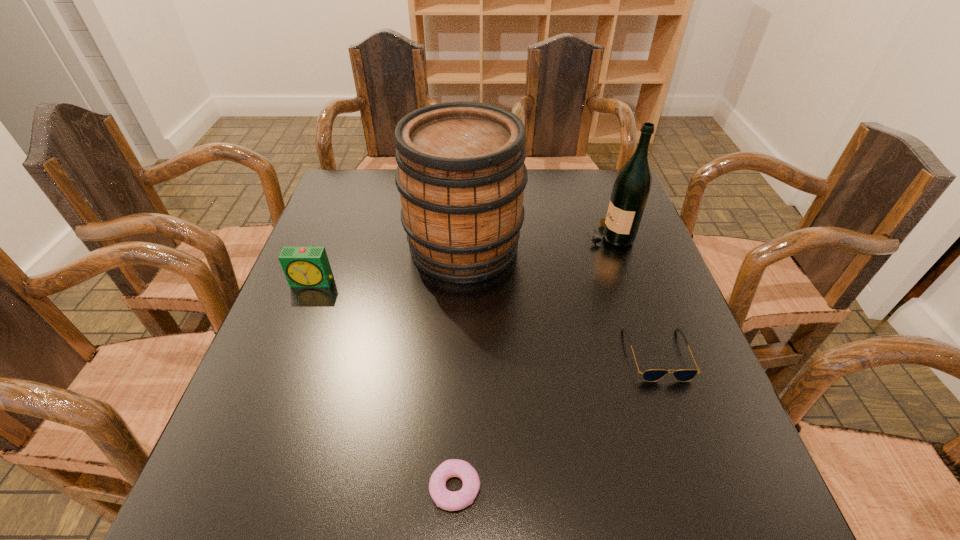
I want to click on cider, so click(x=461, y=175).

The image size is (960, 540). In order to click on wine bottle in this screenshot , I will do `click(631, 189)`.

Locate an element on the screen. This screenshot has width=960, height=540. the third shortest object is located at coordinates (304, 267).

You are a GUI agent. You are given a task and a screenshot of the screen. Output one action in this format:
    pyautogui.click(x=<x>, y=<y>)
    Task: Click on the leftmost object
    
    Given the screenshot: What is the action you would take?
    pyautogui.click(x=304, y=267)

Identify the location of the second shortest object. The image size is (960, 540). (652, 375).

Where is `sunglasses`? sunglasses is located at coordinates (652, 375).

This screenshot has height=540, width=960. In order to click on the shortest object in this screenshot , I will do `click(448, 500)`.

Where is `doughnut`? The width and height of the screenshot is (960, 540). doughnut is located at coordinates (448, 500).

I want to click on vacant region located 0.210m on the right of the cider, so click(600, 247).

Where is `vacant space positioned on the front of the wine bottle`? This screenshot has height=540, width=960. vacant space positioned on the front of the wine bottle is located at coordinates (621, 269).